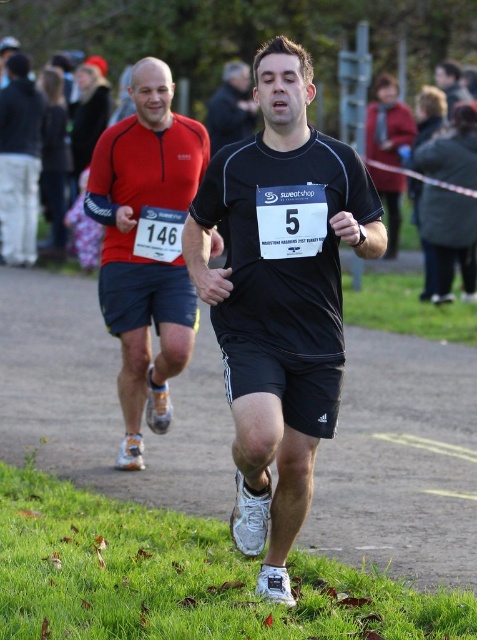
Question: Considering the relative positions of matte black shorts at left and dark brown hair at upper center in the image provided, where is matte black shorts at left located with respect to dark brown hair at upper center?

Choices:
 (A) above
 (B) below

Answer: (B)

Question: Based on their relative distances, which object is nearer to the black matte running shirt at center?

Choices:
 (A) black fabric shorts at center
 (B) matte red running shirt at left
 (C) dark brown hair at upper center

Answer: (B)

Question: Among these objects, which one is nearest to the camera?

Choices:
 (A) black fabric shorts at center
 (B) matte black shorts at left
 (C) black matte running shorts at center
 (D) black matte running shirt at center

Answer: (D)

Question: Which is farther from the matte red running shirt at left?

Choices:
 (A) black fabric shorts at center
 (B) black matte running shorts at center

Answer: (B)

Question: From the image, what is the correct spatial relationship of matte red running shirt at left in relation to dark brown hair at upper center?

Choices:
 (A) right
 (B) left

Answer: (B)

Question: Is matte red running shirt at left further to camera compared to black matte running shorts at center?

Choices:
 (A) yes
 (B) no

Answer: (B)